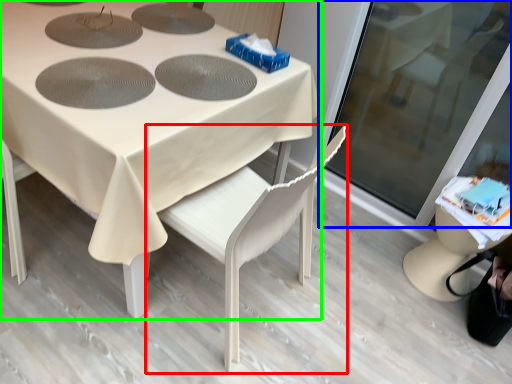
Question: Considering the real-world distances, which object is farthest from chair (highlighted by a red box)? screen door (highlighted by a blue box) or table (highlighted by a green box)?

Choices:
 (A) screen door
 (B) table

Answer: (A)